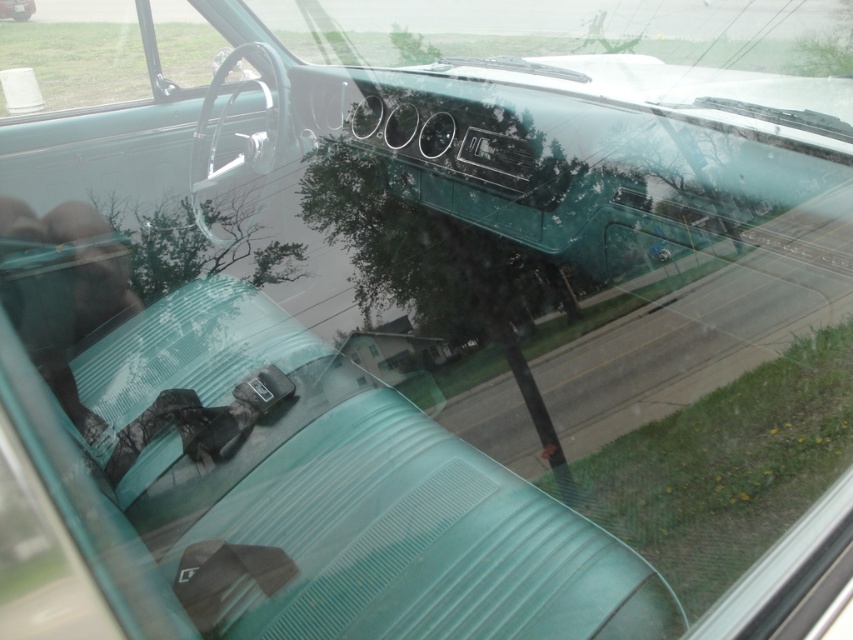
You are a passenger in the vintage car and want to look at the suburban street outside. Which glass surface, the clear glass windshield at upper center or the transparent glass window at center, allows you to see a larger portion of the street?

The clear glass windshield at upper center allows you to see a larger portion of the street because it is taller than the transparent glass window at center.